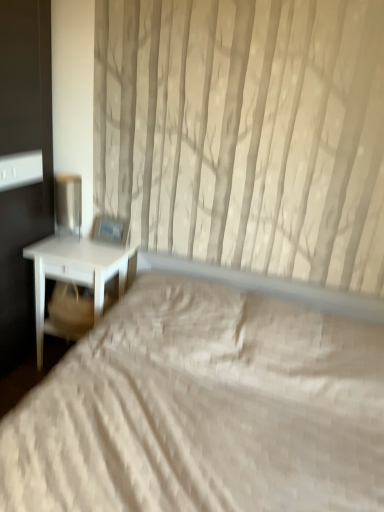
The height and width of the screenshot is (512, 384). What do you see at coordinates (77, 273) in the screenshot? I see `white matte nightstand at left` at bounding box center [77, 273].

Where is `beige fabric swivel chair at left`? Image resolution: width=384 pixels, height=512 pixels. beige fabric swivel chair at left is located at coordinates (71, 310).

I want to click on white matte nightstand at left, so pos(77,273).

From a real-world perspective, is metallic silver table lamp at left located higher than white quilted bed at center?

Correct, in the physical world, metallic silver table lamp at left is higher than white quilted bed at center.

In the scene shown: Considering the sizes of metallic silver table lamp at left and white quilted bed at center in the image, is metallic silver table lamp at left taller or shorter than white quilted bed at center?

Considering their sizes, metallic silver table lamp at left has less height than white quilted bed at center.

In the image, is metallic silver table lamp at left positioned in front of or behind white quilted bed at center?

Visually, metallic silver table lamp at left is located behind white quilted bed at center.

Between point (75, 229) and point (112, 478), which one is positioned in front?

Positioned in front is point (112, 478).

Is white matte nightstand at left turned away from metallic silver table lamp at left?

No, white matte nightstand at left is not facing the opposite direction of metallic silver table lamp at left.

Can you confirm if white matte nightstand at left is shorter than metallic silver table lamp at left?

Incorrect, the height of white matte nightstand at left does not fall short of that of metallic silver table lamp at left.

Is white matte nightstand at left far from metallic silver table lamp at left?

They are positioned close to each other.

Where is `table lamp that appears above the white matte nightstand at left (from a real-world perspective)`? Image resolution: width=384 pixels, height=512 pixels. table lamp that appears above the white matte nightstand at left (from a real-world perspective) is located at coordinates (68, 203).

Considering the positions of objects white quilted bed at center and beige fabric swivel chair at left in the image provided, who is in front, white quilted bed at center or beige fabric swivel chair at left?

Positioned in front is white quilted bed at center.

From a real-world perspective, who is located higher, white quilted bed at center or beige fabric swivel chair at left?

beige fabric swivel chair at left is physically above.

Considering the relative sizes of white quilted bed at center and beige fabric swivel chair at left in the image provided, is white quilted bed at center taller than beige fabric swivel chair at left?

Yes, white quilted bed at center is taller than beige fabric swivel chair at left.

Can you see white quilted bed at center touching beige fabric swivel chair at left?

No, white quilted bed at center is not with beige fabric swivel chair at left.

From a real-world perspective, is metallic silver table lamp at left positioned under beige fabric swivel chair at left based on gravity?

Actually, metallic silver table lamp at left is physically above beige fabric swivel chair at left in the real world.

Can you confirm if metallic silver table lamp at left is shorter than beige fabric swivel chair at left?

No, metallic silver table lamp at left is not shorter than beige fabric swivel chair at left.

Is point (72, 229) farther from camera compared to point (82, 322)?

Yes, point (72, 229) is farther from viewer.

Which object is closer to the camera taking this photo, white quilted bed at center or metallic silver table lamp at left?

white quilted bed at center is more forward.

Is white quilted bed at center positioned far away from metallic silver table lamp at left?

Yes.

I want to click on bed located in front of the metallic silver table lamp at left, so click(203, 409).

How far apart are white quilted bed at center and metallic silver table lamp at left?

1.07 meters.

Considering the sizes of metallic silver table lamp at left and white matte nightstand at left in the image, is metallic silver table lamp at left wider or thinner than white matte nightstand at left?

metallic silver table lamp at left is thinner than white matte nightstand at left.

Is metallic silver table lamp at left far away from white matte nightstand at left?

No, metallic silver table lamp at left is not far away from white matte nightstand at left.

From the picture: How different are the orientations of metallic silver table lamp at left and white matte nightstand at left in degrees?

There is a 0.428-degree angle between the facing directions of metallic silver table lamp at left and white matte nightstand at left.

Consider the image. How far apart are beige fabric swivel chair at left and white matte nightstand at left?

They are 11.24 centimeters apart.

Is beige fabric swivel chair at left surrounding white matte nightstand at left?

No, white matte nightstand at left is located outside of beige fabric swivel chair at left.

Is beige fabric swivel chair at left turned away from white matte nightstand at left?

Yes, beige fabric swivel chair at left's orientation is away from white matte nightstand at left.

From the image's perspective, which is below, beige fabric swivel chair at left or white matte nightstand at left?

white matte nightstand at left appears lower in the image.

Image resolution: width=384 pixels, height=512 pixels. Find the location of `bed on the right side of metallic silver table lamp at left`. bed on the right side of metallic silver table lamp at left is located at coordinates (203, 409).

Identify the location of nightstand below the metallic silver table lamp at left (from the image's perspective). click(77, 273).

Based on their spatial positions, is beige fabric swivel chair at left or white matte nightstand at left closer to white quilted bed at center?

white matte nightstand at left lies closer to white quilted bed at center than the other object.

Considering their positions, is white matte nightstand at left positioned closer to white quilted bed at center than metallic silver table lamp at left?

Based on the image, white matte nightstand at left appears to be nearer to white quilted bed at center.

Considering their positions, is metallic silver table lamp at left positioned further to beige fabric swivel chair at left than white matte nightstand at left?

metallic silver table lamp at left lies further to beige fabric swivel chair at left than the other object.

When comparing their distances from white matte nightstand at left, does beige fabric swivel chair at left or white quilted bed at center seem closer?

Based on the image, beige fabric swivel chair at left appears to be nearer to white matte nightstand at left.

Considering their positions, is metallic silver table lamp at left positioned closer to white matte nightstand at left than beige fabric swivel chair at left?

beige fabric swivel chair at left.

Estimate the real-world distances between objects in this image. Which object is further from beige fabric swivel chair at left, white quilted bed at center or white matte nightstand at left?

white quilted bed at center is further to beige fabric swivel chair at left.

Based on their spatial positions, is white quilted bed at center or white matte nightstand at left closer to metallic silver table lamp at left?

Among the two, white matte nightstand at left is located nearer to metallic silver table lamp at left.

Considering their positions, is white quilted bed at center positioned closer to metallic silver table lamp at left than beige fabric swivel chair at left?

beige fabric swivel chair at left.

Locate an element on the screen. nightstand located between white quilted bed at center and beige fabric swivel chair at left in the depth direction is located at coordinates (77, 273).

Locate an element on the screen. swivel chair between metallic silver table lamp at left and white matte nightstand at left vertically is located at coordinates (71, 310).

At what (x,y) coordinates should I click in order to perform the action: click on swivel chair positioned between white quilted bed at center and metallic silver table lamp at left from near to far. Please return your answer as a coordinate pair (x, y). This screenshot has width=384, height=512. Looking at the image, I should click on (71, 310).

Locate an element on the screen. nightstand positioned between white quilted bed at center and metallic silver table lamp at left from near to far is located at coordinates (77, 273).